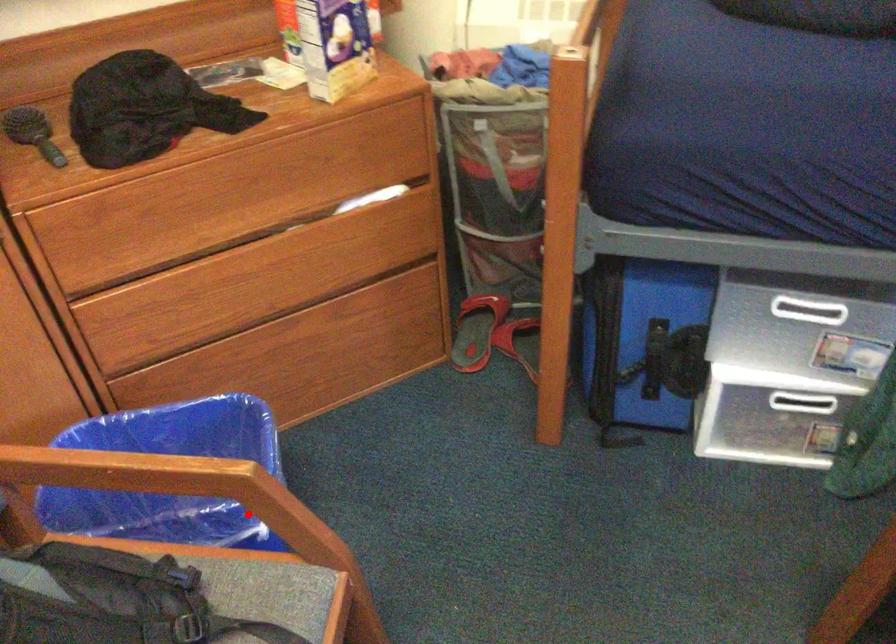
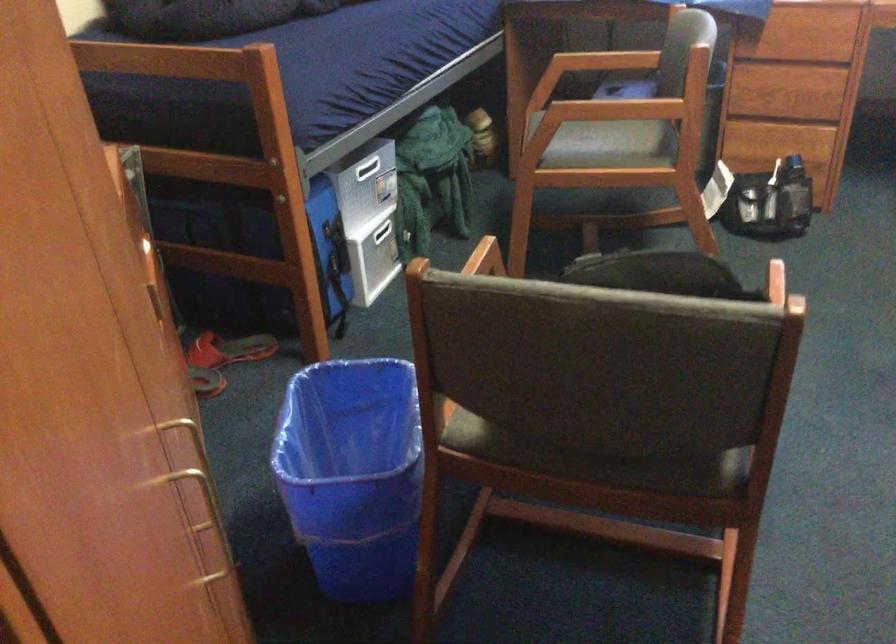
Question: I am providing you with two images of the same scene from different viewpoints. In image1, a red point is highlighted. Considering the same 3D point in image2, which of the following is correct?

Choices:
 (A) It is closer
 (B) It is farther

Answer: (B)